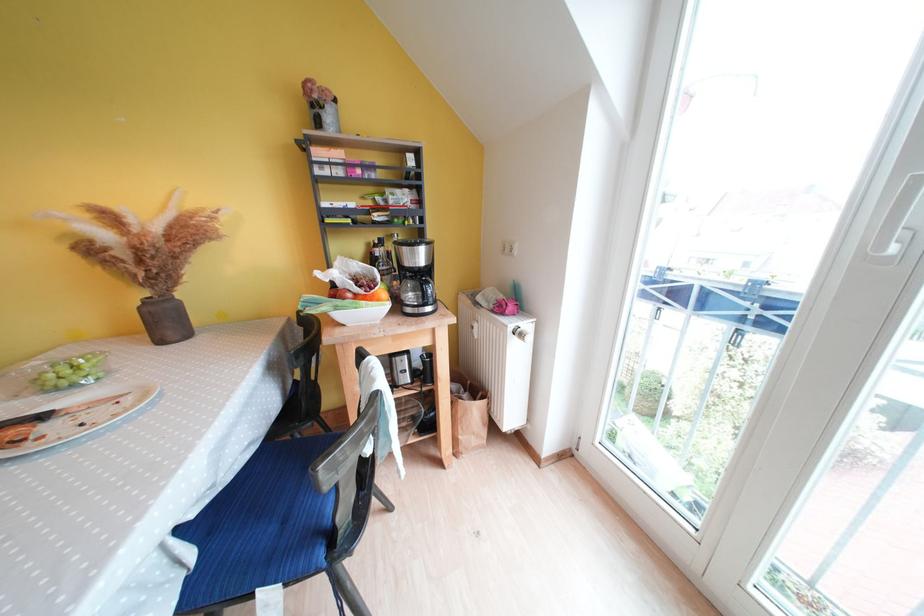
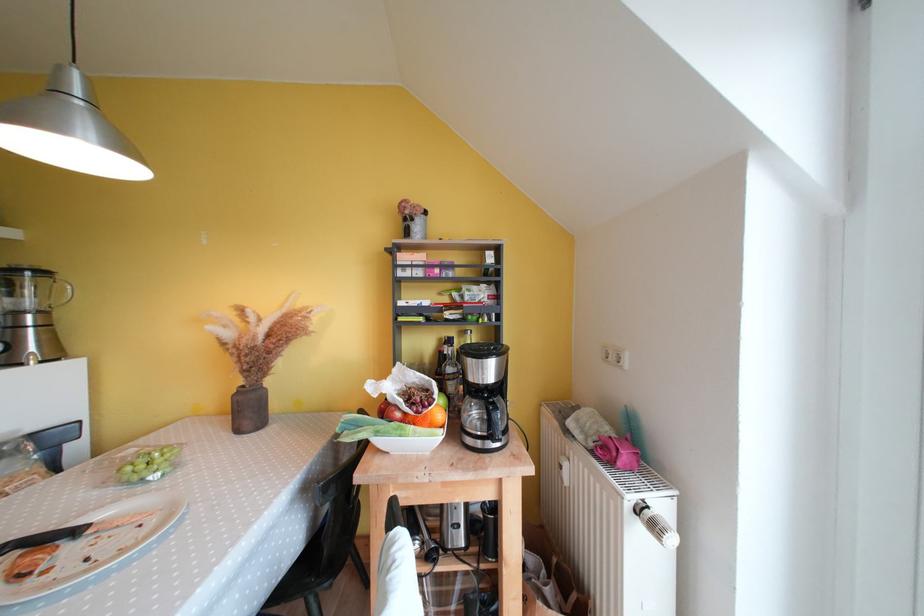
Locate, in the second image, the point that corresponds to (377,292) in the first image.

(431, 411)